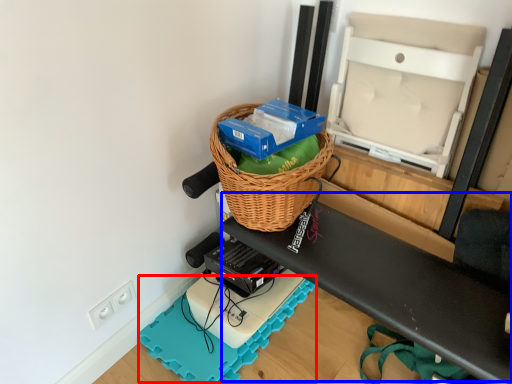
Question: Which point is closer to the camera, yoga mat (highlighted by a red box) or wide (highlighted by a blue box)?

Choices:
 (A) yoga mat
 (B) wide

Answer: (B)